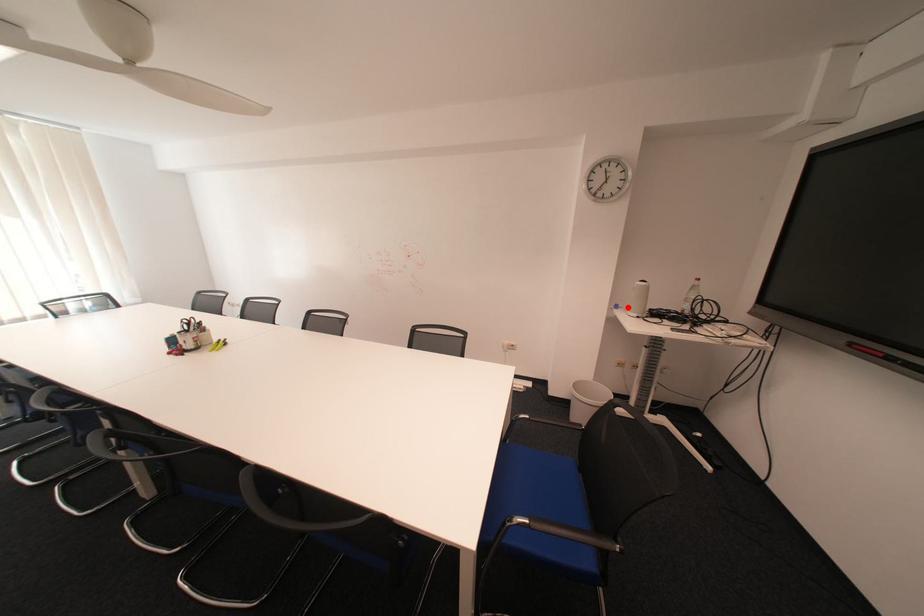
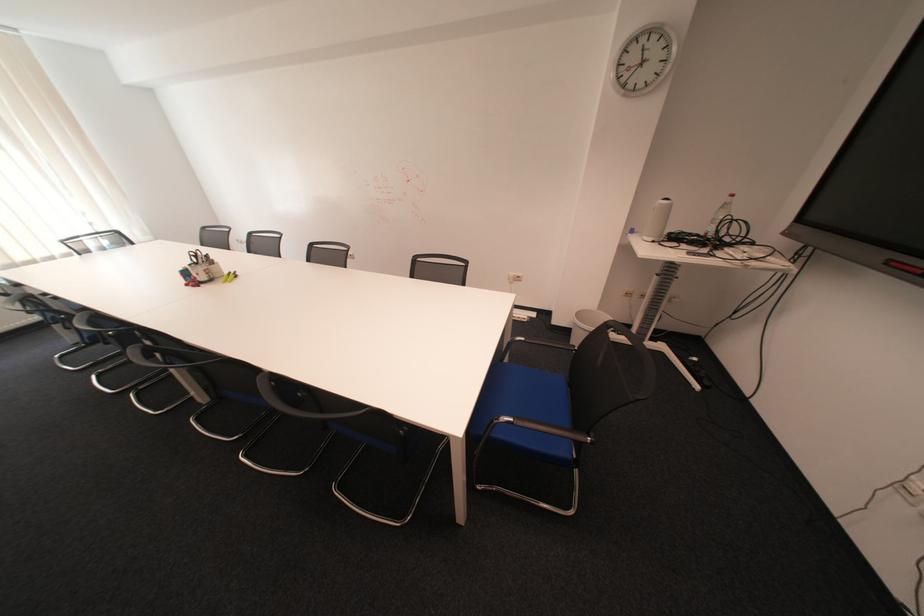
In the second image, find the point that corresponds to the highlighted location in the first image.

(643, 232)